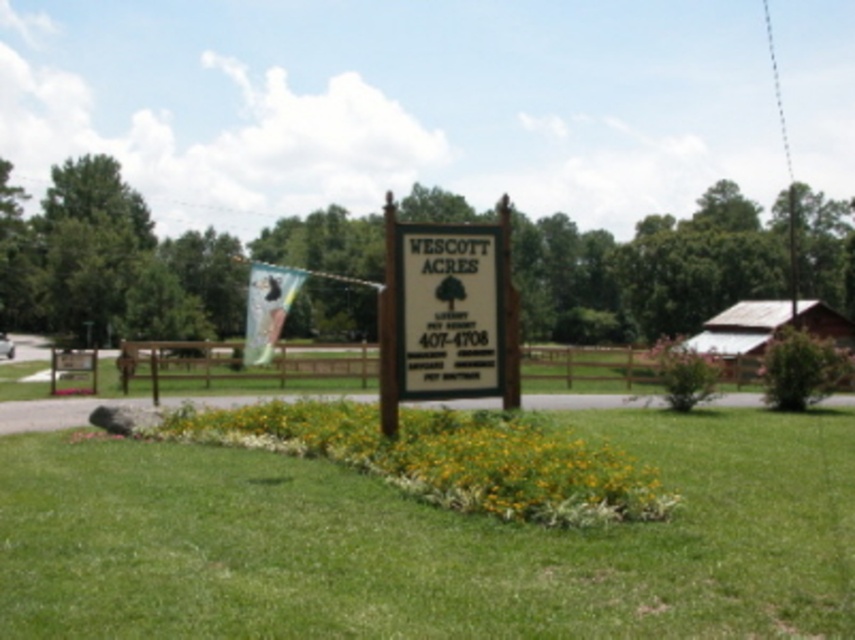
Question: Is yellow-green foliage at center above white matte sign at center?

Choices:
 (A) yes
 (B) no

Answer: (B)

Question: Which point appears closest to the camera in this image?

Choices:
 (A) [x=469, y=227]
 (B) [x=369, y=515]

Answer: (B)

Question: Which point appears closest to the camera in this image?

Choices:
 (A) (358, 429)
 (B) (481, 300)

Answer: (A)

Question: Estimate the real-world distances between objects in this image. Which object is closer to the green grass at center?

Choices:
 (A) white matte sign at center
 (B) yellow-green foliage at center

Answer: (A)

Question: Does green grass at center come behind white matte sign at center?

Choices:
 (A) no
 (B) yes

Answer: (A)

Question: Does green grass at center appear over yellow-green foliage at center?

Choices:
 (A) no
 (B) yes

Answer: (A)